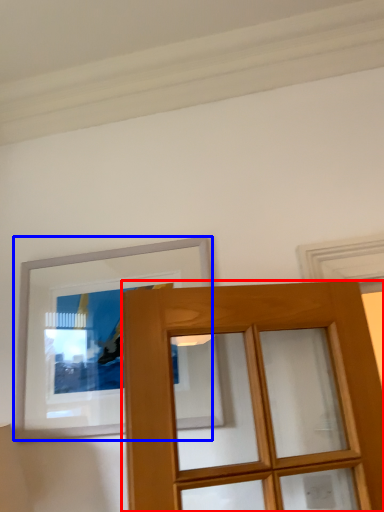
Question: Which object is closer to the camera taking this photo, door (highlighted by a red box) or picture frame (highlighted by a blue box)?

Choices:
 (A) door
 (B) picture frame

Answer: (A)